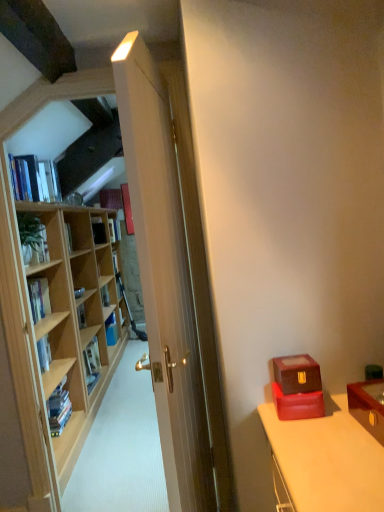
Question: From the image's perspective, is hardcover book at left, which is the second book in front-to-back order, positioned above or below wooden bookshelf at left, arranged as the 6th book when viewed from the front?

Choices:
 (A) below
 (B) above

Answer: (A)

Question: From a real-world perspective, is hardcover book at left, placed as the ninth book when sorted from back to front, positioned above or below wooden bookshelf at left, the fifth book when ordered from back to front?

Choices:
 (A) below
 (B) above

Answer: (A)

Question: Estimate the real-world distances between objects in this image. Which object is farther from the blue glossy book at left, which ranks as the fourth book in back-to-front order?

Choices:
 (A) hardcover book at center, arranged as the first book when viewed from the back
 (B) hardcover book at left, which is the second book in front-to-back order
 (C) wooden bookshelf at left, the fifth book when ordered from back to front
 (D) green matte plant at left, the 7th book in the back-to-front sequence
 (E) hardcover books at left, marked as the first book in a front-to-back arrangement

Answer: (E)

Question: Estimate the real-world distances between objects in this image. Which object is closer to the wooden chest at right?

Choices:
 (A) wooden bookshelf at left, arranged as the 6th book when viewed from the front
 (B) white wooden door at center
 (C) green matte plant at left, the 4th book from the front
 (D) hardcover book at left, which is the second book in front-to-back order
 (E) hardcover book at center, which is the ninth book from front to back

Answer: (B)